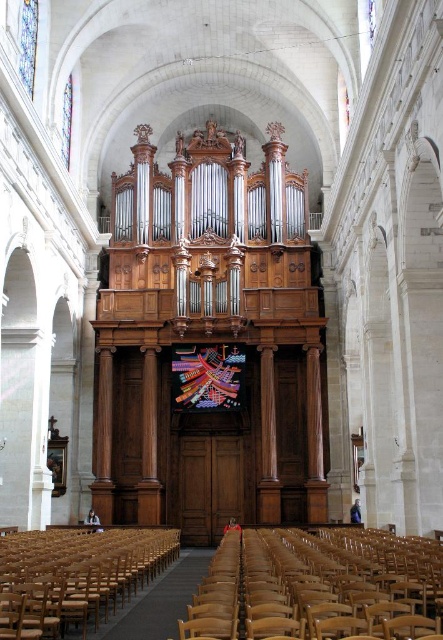
You are standing in the grand church and want to sit down. You see the light brown wooden chair at lower center and the wooden chair at lower left. Which chair is closer to you?

The light brown wooden chair at lower center is closer to you than the wooden chair at lower left.

You are an event planner setting up chairs for a small concert in the church. You have two chairs to place in the front row. The light brown wooden chair at lower center and the wooden chair at lower left. Which chair should you choose if you want to seat a guest who requires more space?

The light brown wooden chair at lower center has a larger width than the wooden chair at lower left, so it would provide more space for the guest.

You are standing in the grand church and want to take a photo of the large ornate wooden organ positioned centrally against the back wall. You notice a point at coordinates point (329,557) that is 164.93 feet away from you. Is this point likely part of the organ or somewhere else in the church?

The point (329,557) is 164.93 feet away from the camera. Since the organ is positioned centrally against the back wall, which is likely farther away than other structures, this point is likely part of the organ.